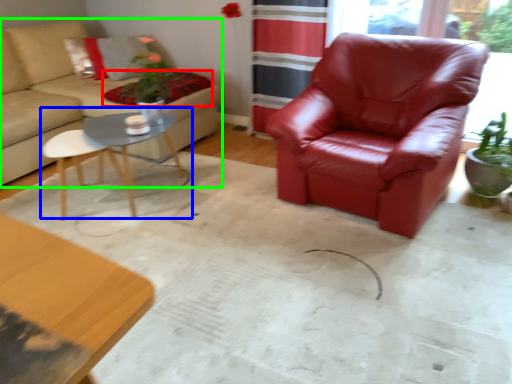
Question: Considering the real-world distances, which object is farthest from blanket (highlighted by a red box)? coffee table (highlighted by a blue box) or studio couch (highlighted by a green box)?

Choices:
 (A) coffee table
 (B) studio couch

Answer: (A)